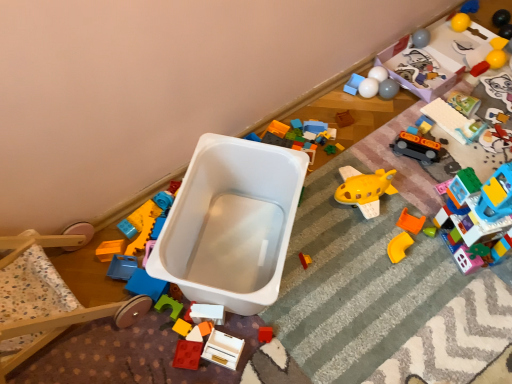
Locate an element on the screen. The image size is (512, 384). vacant region in front of translucent plastic building blocks at right, positioned as the 12th toy in left-to-right order is located at coordinates (473, 303).